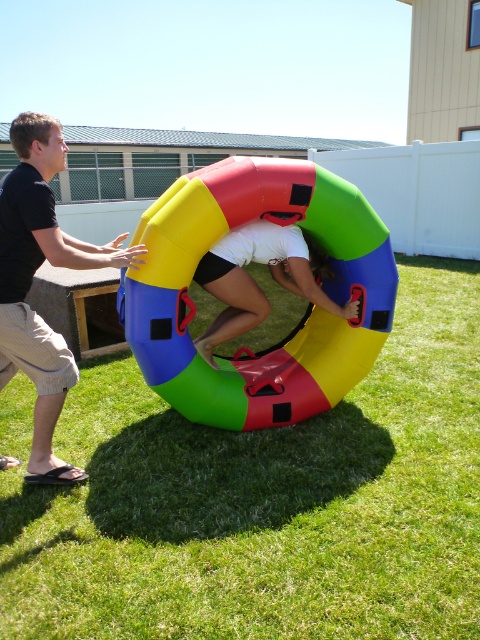
Does green grass at center have a smaller size compared to white matte shorts at center?

No.

Between green grass at center and white matte shorts at center, which one has less height?

white matte shorts at center

Who is more distant from viewer, (285,536) or (214,332)?

The point (214,332) is more distant.

This screenshot has width=480, height=640. Find the location of `green grass at center`. green grass at center is located at coordinates (265, 502).

Image resolution: width=480 pixels, height=640 pixels. Find the location of `green grass at center`. green grass at center is located at coordinates (265, 502).

Between point (39, 513) and point (3, 368), which one is positioned behind?

Positioned behind is point (3, 368).

At what (x,y) coordinates should I click in order to perform the action: click on green grass at center. Please return your answer as a coordinate pair (x, y). The width and height of the screenshot is (480, 640). Looking at the image, I should click on (265, 502).

Between black matte shirt at left and white matte shorts at center, which one is positioned higher?

white matte shorts at center

Is black matte shirt at left positioned before white matte shorts at center?

Yes, black matte shirt at left is closer to the viewer.

The image size is (480, 640). In order to click on black matte shirt at left in this screenshot , I will do `click(32, 280)`.

I want to click on black matte shirt at left, so click(x=32, y=280).